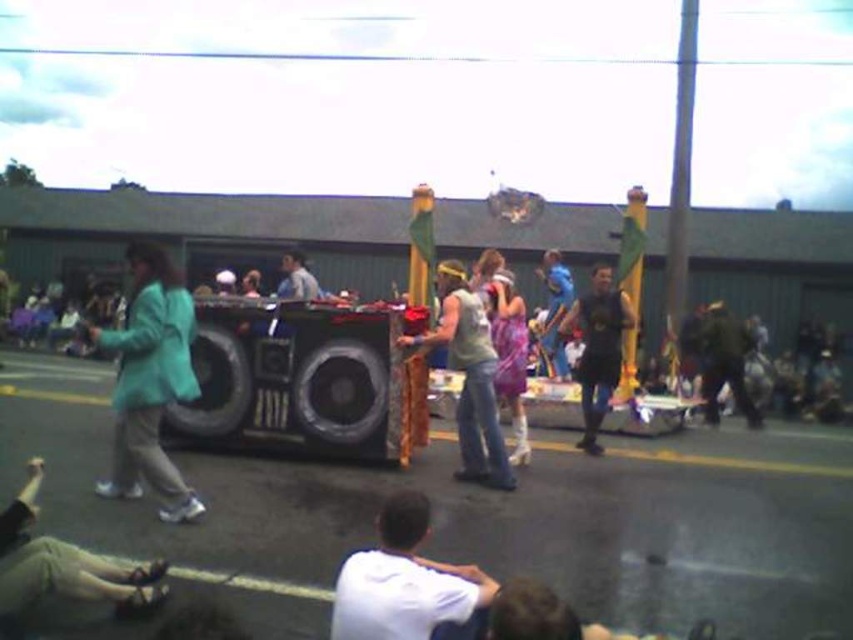
Which is behind, point (450, 328) or point (317, 289)?

The point (317, 289) is behind.

Does matte gold fabric at center appear under light blue shirt at center?

Indeed, matte gold fabric at center is positioned under light blue shirt at center.

Locate an element on the screen. Image resolution: width=853 pixels, height=640 pixels. matte gold fabric at center is located at coordinates (469, 378).

Does shiny black speaker at center have a lesser width compared to dark green fabric jacket at right?

No, shiny black speaker at center is not thinner than dark green fabric jacket at right.

Between shiny black speaker at center and dark green fabric jacket at right, which one appears on the right side from the viewer's perspective?

Positioned to the right is dark green fabric jacket at right.

Measure the distance between shiny black speaker at center and camera.

shiny black speaker at center is 6.20 meters away from camera.

Image resolution: width=853 pixels, height=640 pixels. What are the coordinates of `shiny black speaker at center` in the screenshot? It's located at (296, 378).

How much distance is there between matte gold fabric at center and dark green fabric jacket at right?

18.10 feet

Is matte gold fabric at center below dark green fabric jacket at right?

No, matte gold fabric at center is not below dark green fabric jacket at right.

Image resolution: width=853 pixels, height=640 pixels. Describe the element at coordinates (469, 378) in the screenshot. I see `matte gold fabric at center` at that location.

Identify the location of matte gold fabric at center. (469, 378).